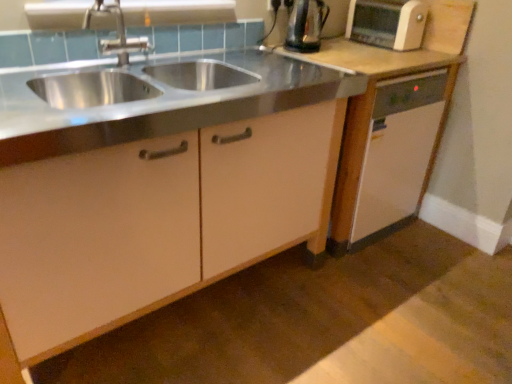
Question: From the image's perspective, is brushed metal faucet at upper left above or below white plastic toaster at upper right?

Choices:
 (A) above
 (B) below

Answer: (B)

Question: From a real-world perspective, is brushed metal faucet at upper left above or below white plastic toaster at upper right?

Choices:
 (A) above
 (B) below

Answer: (B)

Question: Which of these objects is positioned farthest from the metallic silver kettle at upper right?

Choices:
 (A) white plastic electric outlet at center
 (B) white matte dishwasher at right, arranged as the second cabinetry when viewed from the left
 (C) white plastic toaster at upper right
 (D) matte white cabinet at center, marked as the second cabinetry in a right-to-left arrangement
 (E) brushed metal faucet at upper left

Answer: (D)

Question: Estimate the real-world distances between objects in this image. Which object is farther from the metallic silver kettle at upper right?

Choices:
 (A) white plastic electric outlet at center
 (B) matte white cabinet at center, marked as the second cabinetry in a right-to-left arrangement
 (C) white matte dishwasher at right, arranged as the second cabinetry when viewed from the left
 (D) brushed metal faucet at upper left
 (E) white plastic toaster at upper right

Answer: (B)